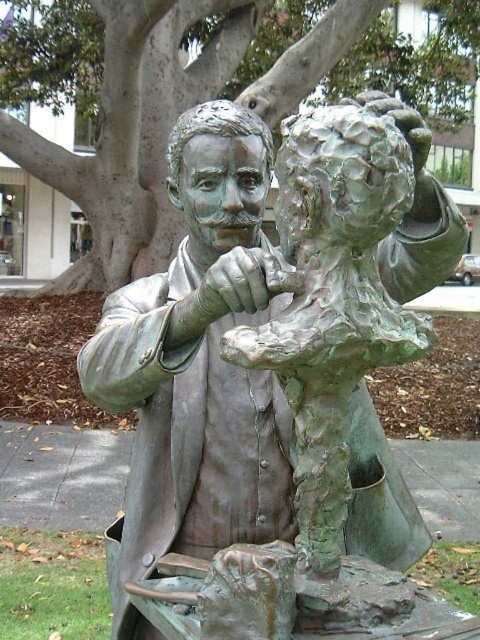
From the picture: You are a visitor at the park and want to take a photo of the green patina bronze statue at center without the green textured tree at upper center blocking the view. Is this possible?

The green patina bronze statue at center is positioned under the green textured tree at upper center, so the tree will block the view of the statue from above. To take a photo without the tree blocking, you would need to position yourself so that the statue is not directly under the tree in the frame, perhaps by moving to the side or adjusting the angle.